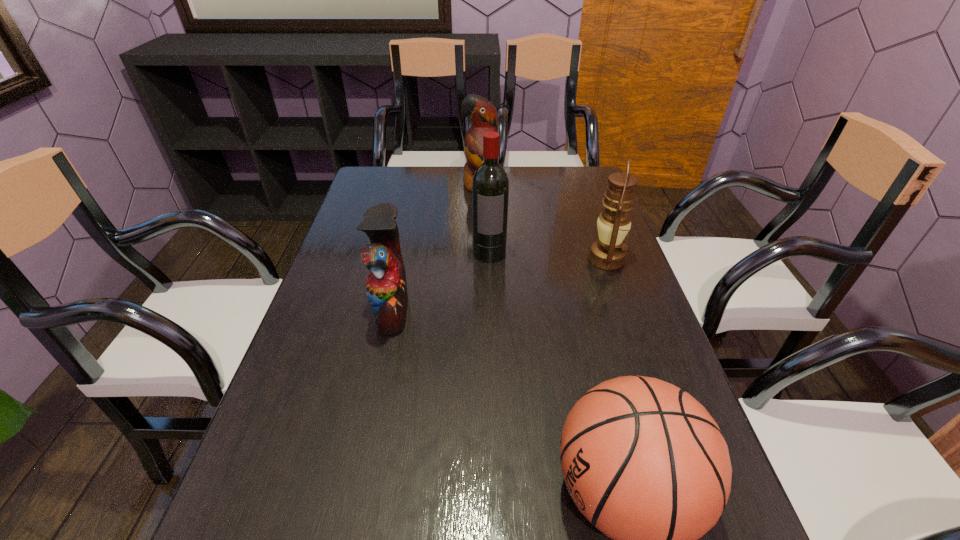
This screenshot has height=540, width=960. In order to click on wine bottle in this screenshot , I will do `click(490, 187)`.

What are the coordinates of `the right parrot` in the screenshot? It's located at (482, 113).

This screenshot has width=960, height=540. I want to click on the farthest object, so click(482, 113).

The height and width of the screenshot is (540, 960). Find the location of `oil lamp`. oil lamp is located at coordinates (608, 253).

At what (x,y) coordinates should I click in order to perform the action: click on the leftmost object. Please return your answer as a coordinate pair (x, y). The height and width of the screenshot is (540, 960). Looking at the image, I should click on (386, 287).

What are the coordinates of `the nearer parrot` in the screenshot? It's located at (386, 287).

Locate an element on the screen. This screenshot has height=540, width=960. free location located on the label of the wine bottle is located at coordinates (492, 364).

At what (x,y) coordinates should I click in order to perform the action: click on free space located on the face of the right parrot. Please return your answer as a coordinate pair (x, y). Looking at the image, I should click on (481, 205).

This screenshot has height=540, width=960. I want to click on vacant area located 0.260m on the front of the oil lamp, so click(x=639, y=355).

In order to click on vacant space located at the face of the second nearest object in this screenshot , I will do `click(505, 309)`.